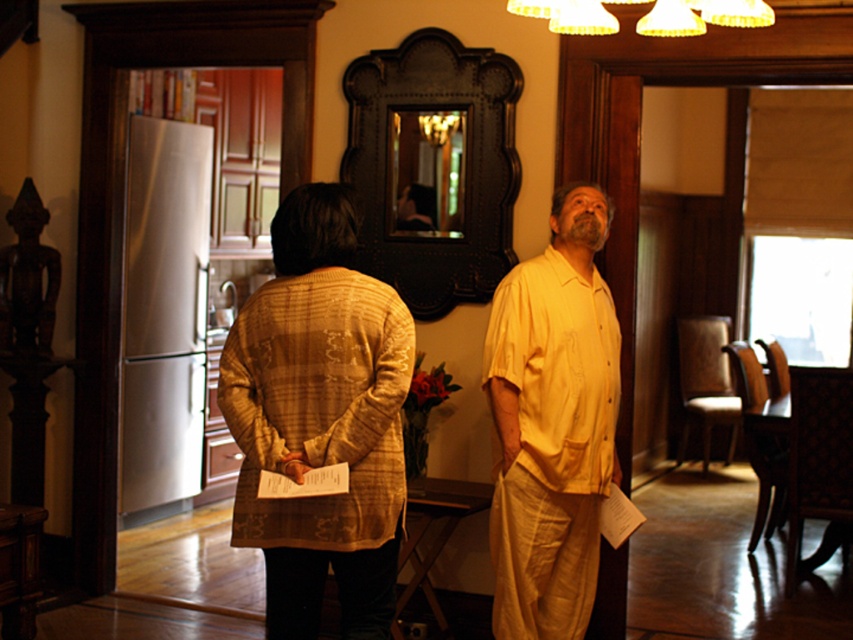
You are a fashion designer observing the two yellow garments in the image. Which one is shorter in height between the matte yellow cardigan at center and the yellow cotton shirt at center?

The matte yellow cardigan at center is shorter in height compared to the yellow cotton shirt at center.